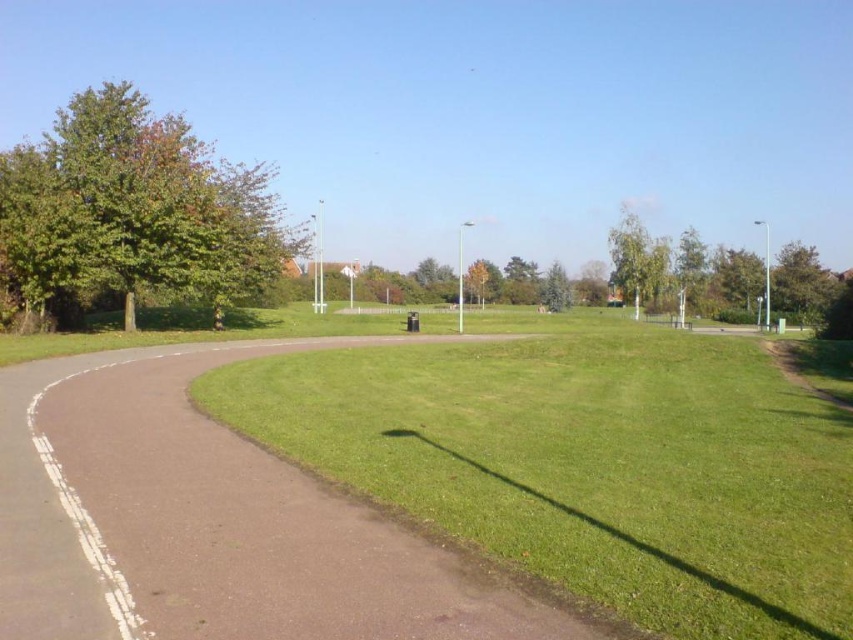
You are a gardener planning to plant a new tree in the park. You notice the brown asphalt path at center and the green leafy tree at upper right. Which object is shorter in height?

The brown asphalt path at center has a lesser height compared to the green leafy tree at upper right, so the brown asphalt path at center is shorter.

You are a gardener planning to mow the green grassy at center and the green leafy tree at upper right. Which area should you mow first if you want to start from the leftmost part of the scene?

The green grassy at center should be mowed first because it is positioned on the left side of the green leafy tree at upper right, making it the leftmost area in the scene.

You are a gardener standing on the brown asphalt path at center. You want to water the green leafy tree at upper center. Can you reach the tree with your hose without leaving the path?

The brown asphalt path at center is in front of the green leafy tree at upper center, so you can reach the tree with your hose while staying on the path.